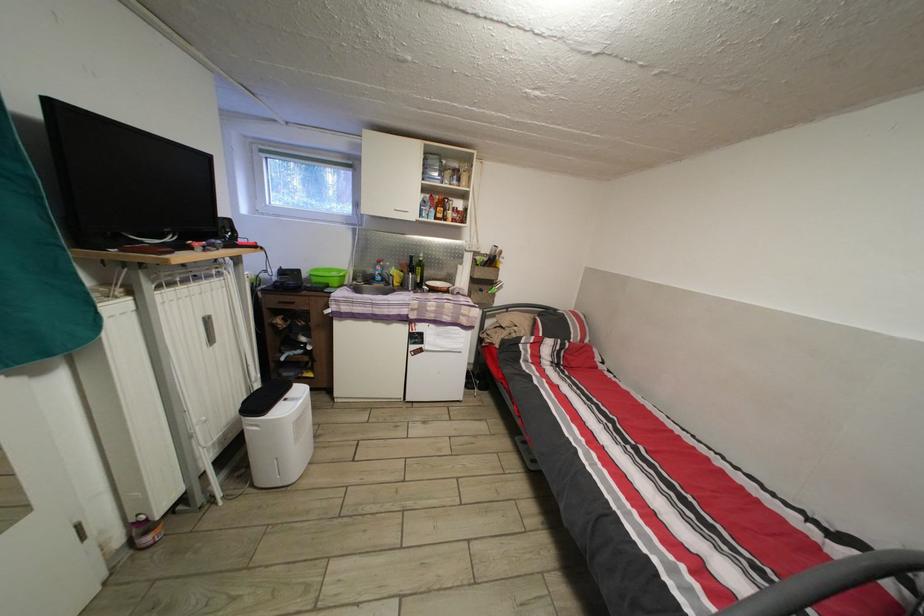
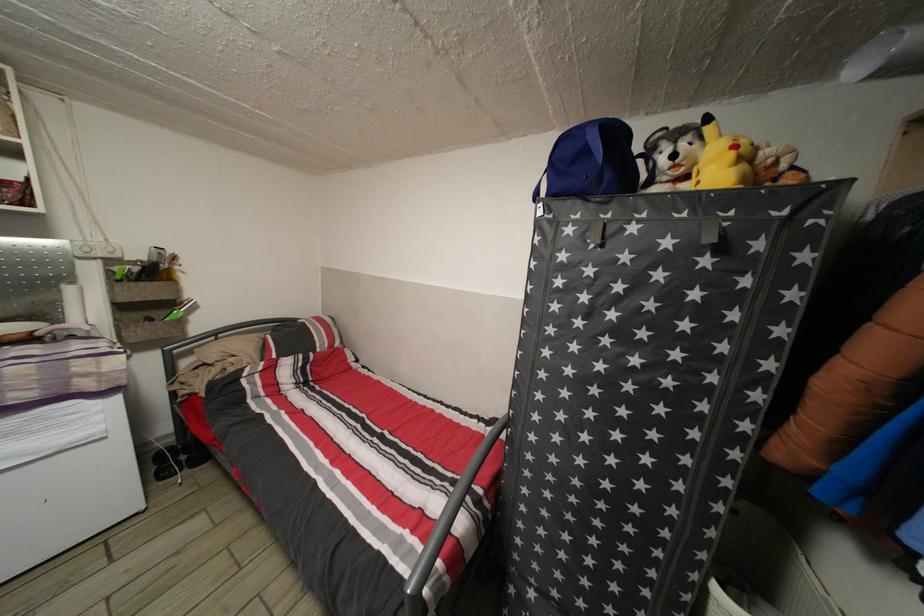
Locate, in the second image, the point that corresponds to pixel 499 276 in the first image.

(164, 291)